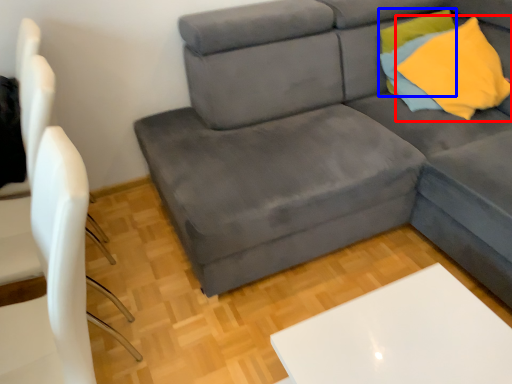
Question: Which object appears farthest to the camera in this image, throw pillow (highlighted by a red box) or pillow (highlighted by a blue box)?

Choices:
 (A) throw pillow
 (B) pillow

Answer: (B)